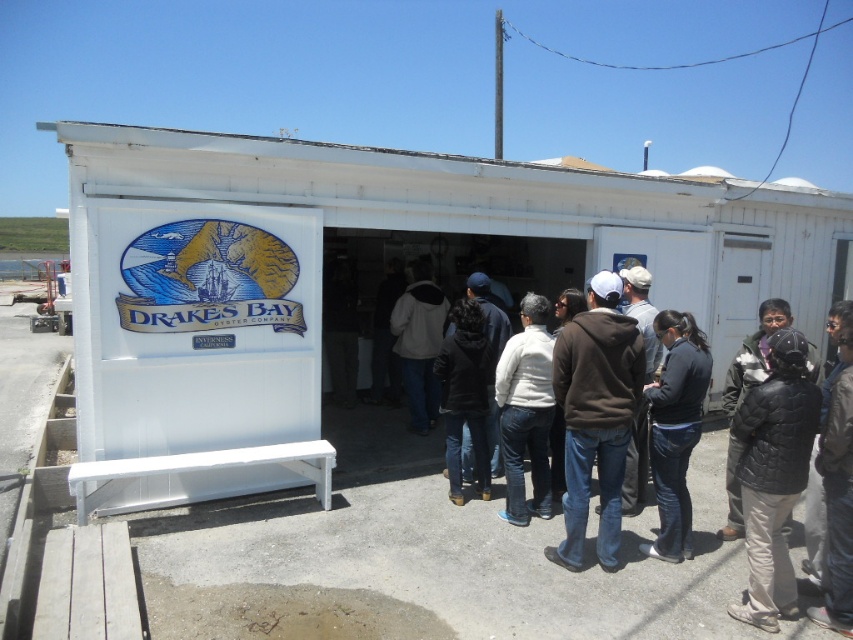
Question: Which object is positioned farthest from the black quilted jacket at lower right?

Choices:
 (A) dark brown hoodie at center
 (B) white matte jacket at center

Answer: (A)

Question: Does brown hoodie at center appear on the right side of white matte jacket at center?

Choices:
 (A) no
 (B) yes

Answer: (B)

Question: Is brown hoodie at center further to camera compared to denim jeans at center?

Choices:
 (A) no
 (B) yes

Answer: (A)

Question: Does white painted wood shed at center have a greater width compared to white matte jacket at center?

Choices:
 (A) no
 (B) yes

Answer: (B)

Question: Which point is farther to the camera?

Choices:
 (A) black quilted jacket at lower right
 (B) matte gray hoodie at center

Answer: (B)

Question: Which of these objects is positioned closest to the matte gray hoodie at center?

Choices:
 (A) white matte jacket at center
 (B) white painted wood shed at center

Answer: (B)